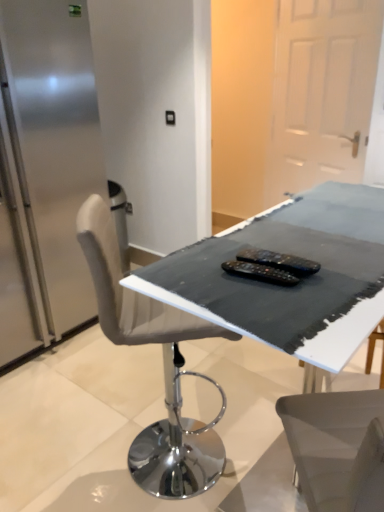
Question: Would you consider black plastic remote controls at center, acting as the 1th equipment starting from the bottom, to be distant from satin silver fridge at left?

Choices:
 (A) no
 (B) yes

Answer: (B)

Question: From a real-world perspective, is black plastic remote controls at center, acting as the 1th equipment starting from the bottom, on satin silver fridge at left?

Choices:
 (A) no
 (B) yes

Answer: (B)

Question: From the image's perspective, does black plastic remote controls at center, arranged as the 2th equipment when viewed from the top, appear higher than satin silver fridge at left?

Choices:
 (A) yes
 (B) no

Answer: (B)

Question: Can you confirm if black plastic remote controls at center, arranged as the 2th equipment when viewed from the top, is wider than satin silver fridge at left?

Choices:
 (A) no
 (B) yes

Answer: (A)

Question: Can you confirm if black plastic remote controls at center, arranged as the 2th equipment when viewed from the top, is thinner than satin silver fridge at left?

Choices:
 (A) yes
 (B) no

Answer: (A)

Question: From the image's perspective, is black plastic remote controls at center, acting as the 1th equipment starting from the bottom, located beneath satin silver fridge at left?

Choices:
 (A) no
 (B) yes

Answer: (B)

Question: From the image's perspective, is black fabric-covered table at center below black plastic remote controls at center, arranged as the 2th equipment when viewed from the top?

Choices:
 (A) yes
 (B) no

Answer: (B)

Question: Is black fabric-covered table at center not within black plastic remote controls at center, acting as the 1th equipment starting from the bottom?

Choices:
 (A) no
 (B) yes

Answer: (B)

Question: From a real-world perspective, does black fabric-covered table at center stand above black plastic remote controls at center, acting as the 1th equipment starting from the bottom?

Choices:
 (A) no
 (B) yes

Answer: (A)

Question: Considering the relative sizes of black fabric-covered table at center and black plastic remote controls at center, acting as the 1th equipment starting from the bottom, in the image provided, is black fabric-covered table at center smaller than black plastic remote controls at center, acting as the 1th equipment starting from the bottom,?

Choices:
 (A) yes
 (B) no

Answer: (B)

Question: Considering the relative positions of black fabric-covered table at center and black plastic remote controls at center, arranged as the 2th equipment when viewed from the top, in the image provided, is black fabric-covered table at center to the left of black plastic remote controls at center, arranged as the 2th equipment when viewed from the top, from the viewer's perspective?

Choices:
 (A) yes
 (B) no

Answer: (B)

Question: Can you confirm if black fabric-covered table at center is thinner than black plastic remote controls at center, arranged as the 2th equipment when viewed from the top?

Choices:
 (A) no
 (B) yes

Answer: (A)

Question: Can you confirm if black plastic remote controls at center, acting as the 1th equipment starting from the bottom, is positioned to the left of white matte door at upper right?

Choices:
 (A) yes
 (B) no

Answer: (A)